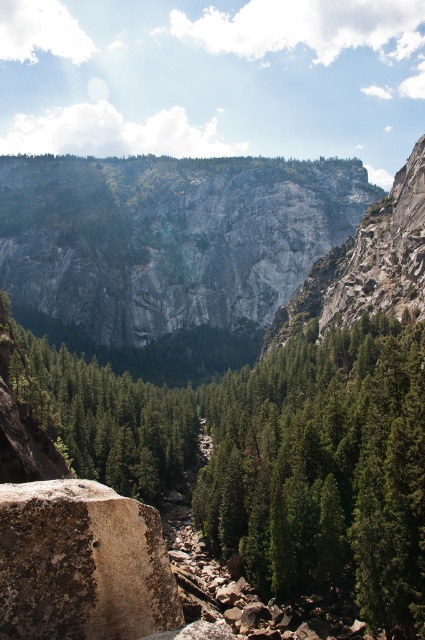
You are a hiker who wants to climb the highest rock formation in the scene. Which one should you choose between the gray rock cliff at center and the rusty brown rock at lower left?

The gray rock cliff at center is taller than the rusty brown rock at lower left, so you should choose the gray rock cliff at center for climbing since it has a greater height.

You are a hiker planning to cross from the rusty brown rock at lower left to the gray rock cliff at center. Given that the distance between them is 10 meters, and your backpack is 2 meters wide, can you safely cross the area between them without your backpack getting stuck?

The gray rock cliff at center is wider than the rusty brown rock at lower left, but the distance between them is 10 meters. Since your backpack is only 2 meters wide, it should fit comfortably within the space, so yes, you can safely cross without your backpack getting stuck.

You are a hiker standing at the top of the mountain looking down. You see a green matte tree at center and a rusty brown rock at lower left. Which object is closer to you?

The green matte tree at center is closer to you because the rusty brown rock at lower left is behind it.